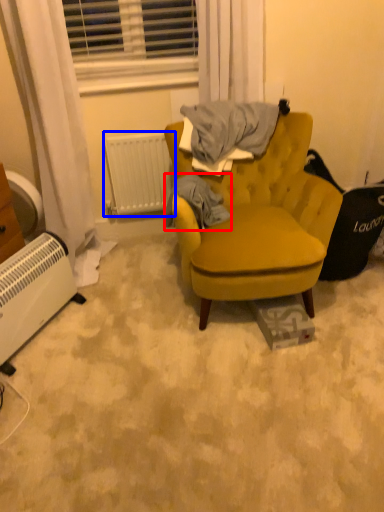
Question: Which object appears closest to the camera in this image, clothing (highlighted by a red box) or radiator (highlighted by a blue box)?

Choices:
 (A) clothing
 (B) radiator

Answer: (A)